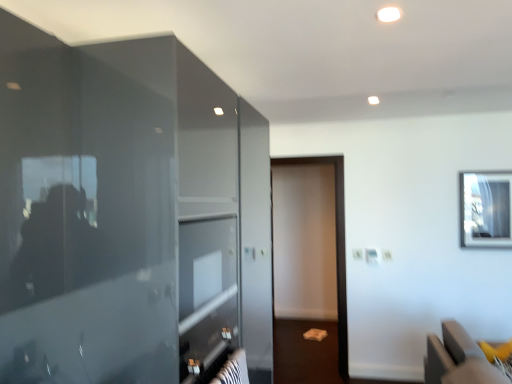
Question: Is clear glass window at upper right far away from yellow fabric cushion at lower right?

Choices:
 (A) yes
 (B) no

Answer: (A)

Question: Does clear glass window at upper right have a greater height compared to yellow fabric cushion at lower right?

Choices:
 (A) no
 (B) yes

Answer: (B)

Question: Is clear glass window at upper right closer to camera compared to yellow fabric cushion at lower right?

Choices:
 (A) no
 (B) yes

Answer: (A)

Question: Is clear glass window at upper right looking in the opposite direction of yellow fabric cushion at lower right?

Choices:
 (A) no
 (B) yes

Answer: (A)

Question: Is clear glass window at upper right completely or partially outside of yellow fabric cushion at lower right?

Choices:
 (A) yes
 (B) no

Answer: (A)

Question: From their relative heights in the image, would you say brown matte screen door at center is taller or shorter than clear glass window at upper right?

Choices:
 (A) tall
 (B) short

Answer: (A)

Question: Is brown matte screen door at center wider or thinner than clear glass window at upper right?

Choices:
 (A) wide
 (B) thin

Answer: (A)

Question: Based on their sizes in the image, would you say brown matte screen door at center is bigger or smaller than clear glass window at upper right?

Choices:
 (A) small
 (B) big

Answer: (B)

Question: Is point (342, 178) positioned closer to the camera than point (481, 230)?

Choices:
 (A) closer
 (B) farther

Answer: (B)

Question: Looking at the image, does glossy glass door at left seem bigger or smaller compared to yellow fabric cushion at lower right?

Choices:
 (A) small
 (B) big

Answer: (B)

Question: Choose the correct answer: Is glossy glass door at left inside yellow fabric cushion at lower right or outside it?

Choices:
 (A) outside
 (B) inside

Answer: (A)

Question: From a real-world perspective, is glossy glass door at left physically located above or below yellow fabric cushion at lower right?

Choices:
 (A) above
 (B) below

Answer: (A)

Question: From the image's perspective, is glossy glass door at left located above or below yellow fabric cushion at lower right?

Choices:
 (A) below
 (B) above

Answer: (B)

Question: Is yellow fabric cushion at lower right spatially inside clear glass window at upper right, or outside of it?

Choices:
 (A) inside
 (B) outside

Answer: (B)

Question: In the image, is yellow fabric cushion at lower right positioned in front of or behind clear glass window at upper right?

Choices:
 (A) front
 (B) behind

Answer: (A)